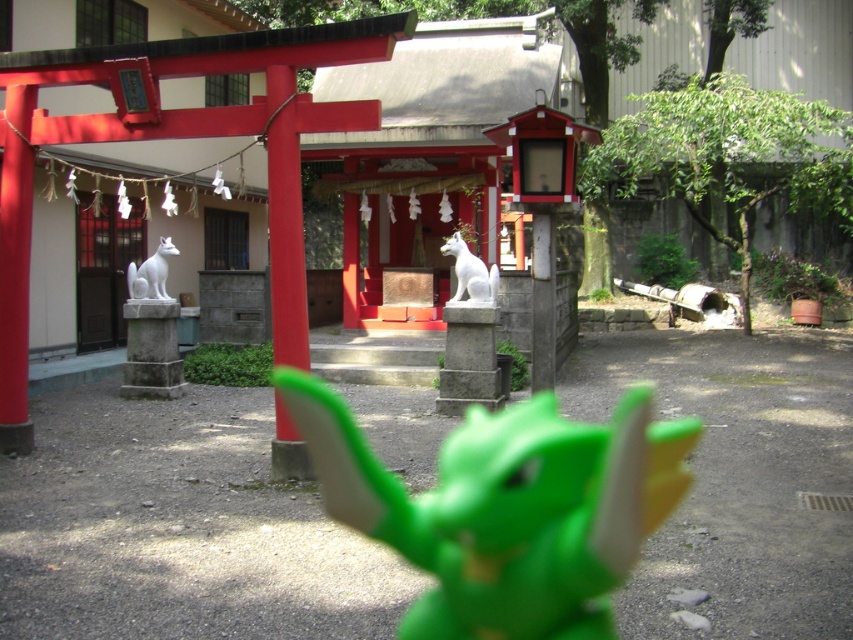
How distant is white glossy statue at center from white marble fox at center?

white glossy statue at center and white marble fox at center are 11.75 feet apart.

Is white glossy statue at center closer to the viewer compared to white marble fox at center?

Yes, it is.

Find the location of a particular element. This screenshot has height=640, width=853. white glossy statue at center is located at coordinates pyautogui.click(x=471, y=273).

Can you confirm if green plastic toy at center is shorter than white glossy statue at center?

In fact, green plastic toy at center may be taller than white glossy statue at center.

Between green plastic toy at center and white glossy statue at center, which one appears on the left side from the viewer's perspective?

white glossy statue at center

Describe the element at coordinates (506, 508) in the screenshot. I see `green plastic toy at center` at that location.

You are a GUI agent. You are given a task and a screenshot of the screen. Output one action in this format:
    pyautogui.click(x=<x>, y=<y>)
    Task: Click on the green plastic toy at center
    The image size is (853, 640).
    Given the screenshot: What is the action you would take?
    pyautogui.click(x=506, y=508)

This screenshot has height=640, width=853. What do you see at coordinates (506, 508) in the screenshot?
I see `green plastic toy at center` at bounding box center [506, 508].

Is green plastic toy at center above white marble fox at center?

Incorrect, green plastic toy at center is not positioned above white marble fox at center.

Find the location of `green plastic toy at center`. green plastic toy at center is located at coordinates (506, 508).